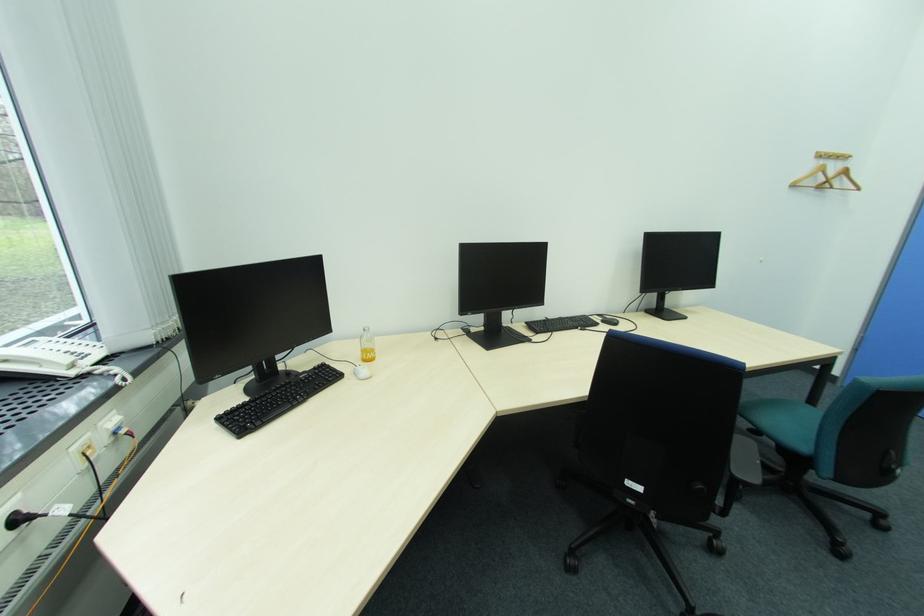
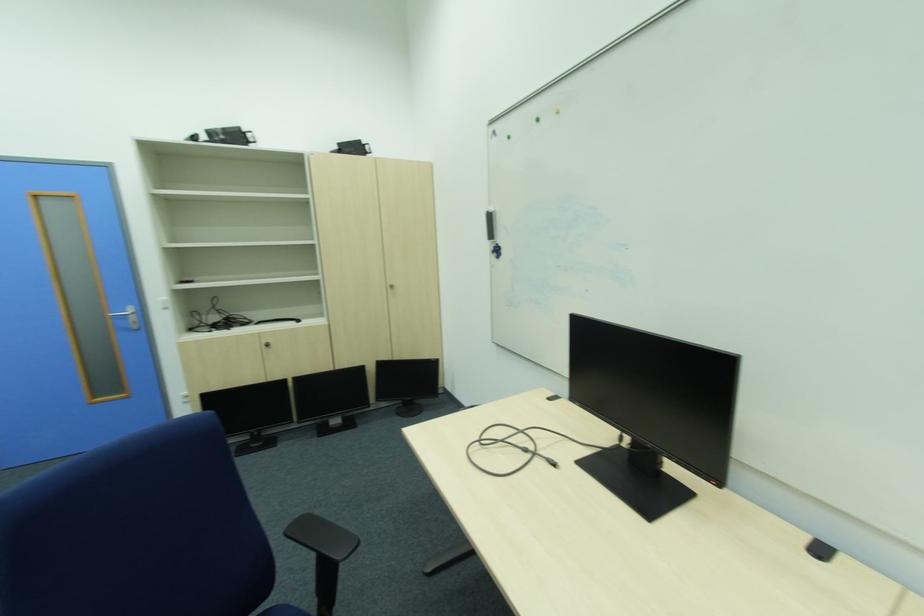
Question: The images are taken continuously from a first-person perspective. In which direction is your viewpoint rotating?

Choices:
 (A) Left
 (B) Right
 (C) Up
 (D) Down

Answer: (B)